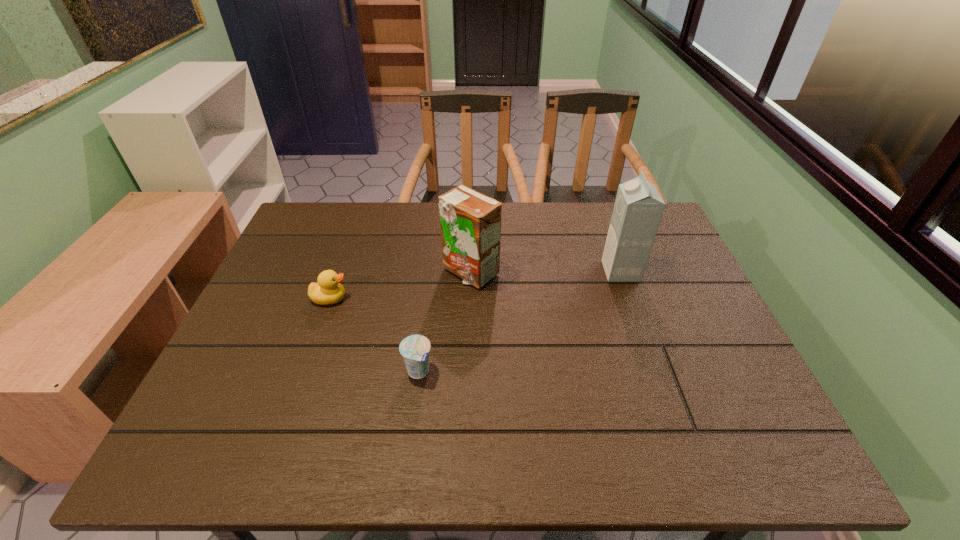
The width and height of the screenshot is (960, 540). In order to click on free space at the near right corner in this screenshot , I will do `click(759, 456)`.

The width and height of the screenshot is (960, 540). Identify the location of free spot between the left carton and the taller carton. (545, 272).

This screenshot has width=960, height=540. Identify the location of vacant area that lies between the yogurt and the rightmost object. pyautogui.click(x=519, y=321).

Locate an element on the screen. The height and width of the screenshot is (540, 960). vacant region between the left carton and the tallest object is located at coordinates (545, 272).

Where is `free spot between the leftmost object and the yogurt`? This screenshot has height=540, width=960. free spot between the leftmost object and the yogurt is located at coordinates (374, 335).

Locate an element on the screen. The image size is (960, 540). unoccupied area between the third shortest object and the nearest object is located at coordinates (444, 322).

This screenshot has height=540, width=960. I want to click on free area in between the leftmost object and the left carton, so click(400, 285).

Where is `free space that is in between the tallest object and the shorter carton`? This screenshot has width=960, height=540. free space that is in between the tallest object and the shorter carton is located at coordinates (545, 272).

Find the location of `free space between the left carton and the nearest object`. free space between the left carton and the nearest object is located at coordinates (444, 322).

This screenshot has width=960, height=540. In order to click on vacant area between the third shortest object and the right carton in this screenshot , I will do `click(545, 272)`.